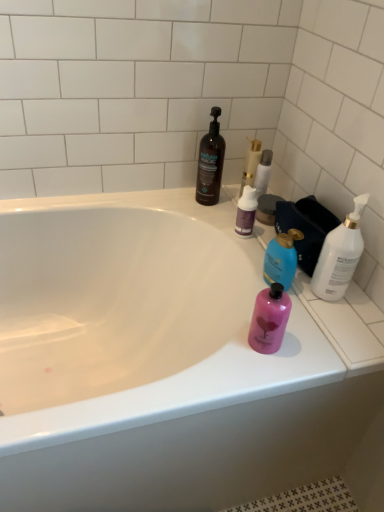
You are a GUI agent. You are given a task and a screenshot of the screen. Output one action in this format:
    pyautogui.click(x=<x>, y=<y>)
    Task: Click on the vacant space to the right of pink matte bottle at right, positioned as the third bottle in right-to-left order
    Image resolution: width=384 pixels, height=512 pixels.
    Given the screenshot: What is the action you would take?
    pyautogui.click(x=322, y=338)